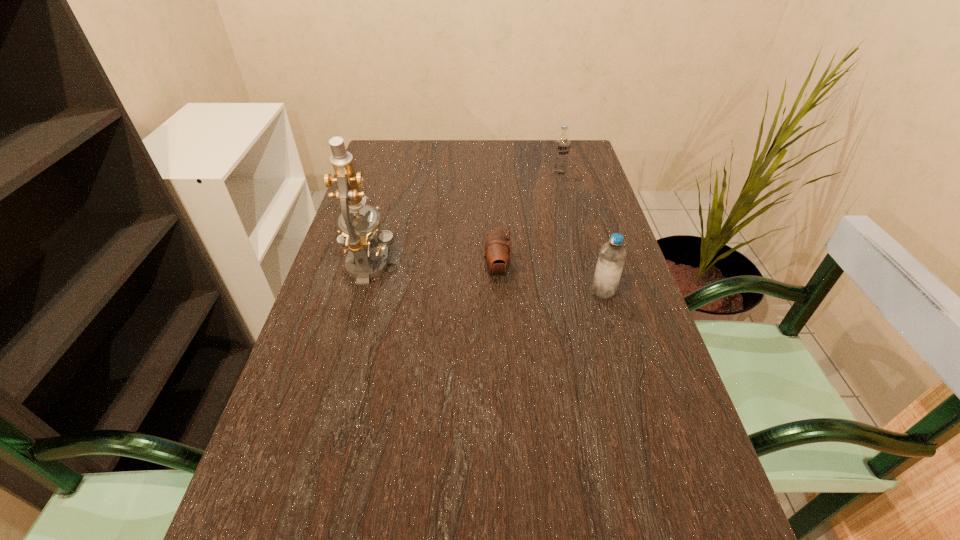
Where is `vacant space located with the flap open on the second object from left to right`? vacant space located with the flap open on the second object from left to right is located at coordinates (389, 271).

I want to click on vacant space situated 0.340m with the flap open on the second object from left to right, so click(x=344, y=271).

Identify the location of object at the far edge. (562, 143).

Where is `object present at the left edge`? Image resolution: width=960 pixels, height=540 pixels. object present at the left edge is located at coordinates (356, 236).

You are a GUI agent. You are given a task and a screenshot of the screen. Output one action in this format:
    pyautogui.click(x=<x>, y=<y>)
    Task: Click on the vodka at the right edge
    The height and width of the screenshot is (540, 960).
    Given the screenshot: What is the action you would take?
    pyautogui.click(x=562, y=143)

This screenshot has width=960, height=540. I want to click on water bottle positioned at the right edge, so click(x=609, y=267).

Where is `object present at the far right corner`? This screenshot has width=960, height=540. object present at the far right corner is located at coordinates (562, 143).

In the image, there is a desktop. Identify the location of vacant space at the far edge. (506, 161).

At what (x,y) coordinates should I click in order to perform the action: click on free region at the left edge of the desktop. Please return your answer as a coordinate pair (x, y). This screenshot has width=960, height=540. Looking at the image, I should click on (341, 289).

Locate an element on the screen. Image resolution: width=960 pixels, height=540 pixels. blank space at the right edge is located at coordinates (594, 227).